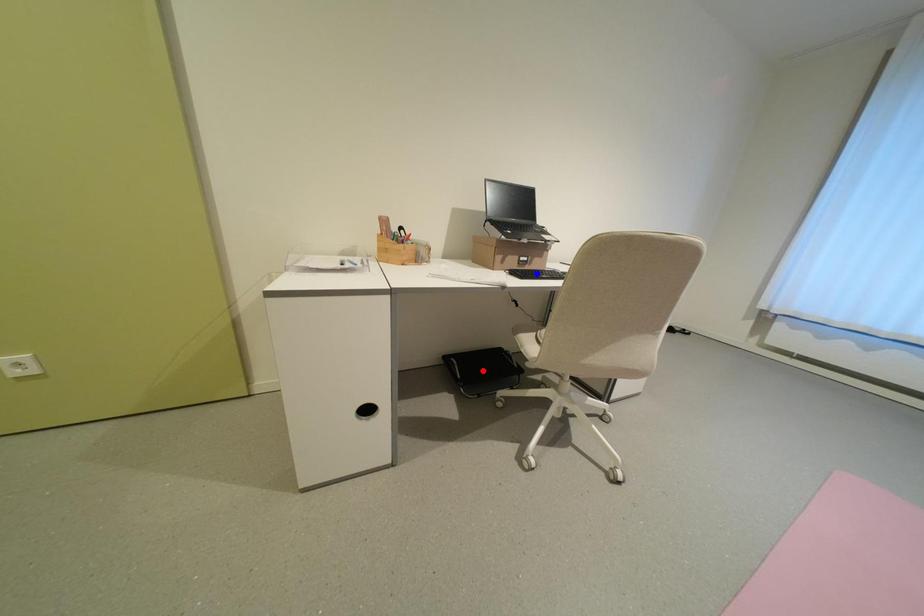
Question: In the image, two points are highlighted. Which point is nearer to the camera? Reply with the corresponding letter.

Choices:
 (A) blue point
 (B) red point

Answer: (A)